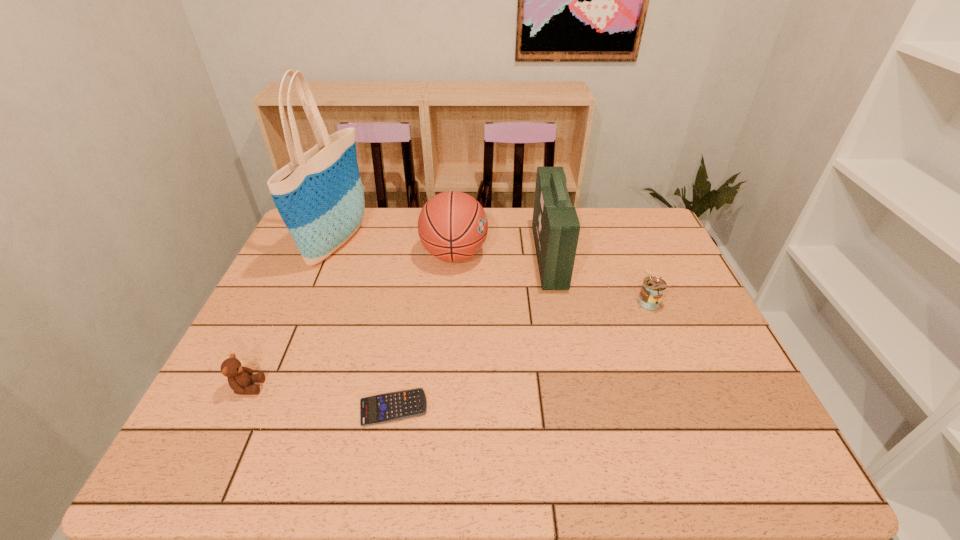
I want to click on teddy bear at the left edge, so click(x=239, y=378).

This screenshot has height=540, width=960. In order to click on object located in the right edge section of the desktop in this screenshot , I will do `click(653, 288)`.

At what (x,y) coordinates should I click in order to perform the action: click on object that is at the far left corner. Please return your answer as a coordinate pair (x, y). Looking at the image, I should click on (319, 195).

In the image, there is a desktop. Identify the location of vacant space at the far edge. The image size is (960, 540). (396, 218).

At what (x,y) coordinates should I click in order to perform the action: click on vacant space at the near edge of the desktop. Please return your answer as a coordinate pair (x, y). This screenshot has height=540, width=960. Looking at the image, I should click on (444, 447).

At what (x,y) coordinates should I click in order to perform the action: click on free space at the left edge of the desktop. Please return your answer as a coordinate pair (x, y). Looking at the image, I should click on (316, 302).

The image size is (960, 540). What are the coordinates of `vacant region at the right edge of the desktop` in the screenshot? It's located at (624, 259).

Image resolution: width=960 pixels, height=540 pixels. In order to click on vacant space at the near left corner in this screenshot , I will do coord(240,467).

In order to click on vacant space at the far right corner in this screenshot , I will do `click(644, 210)`.

In order to click on vacant area that lies between the basketball and the tallest object in this screenshot , I will do `click(396, 248)`.